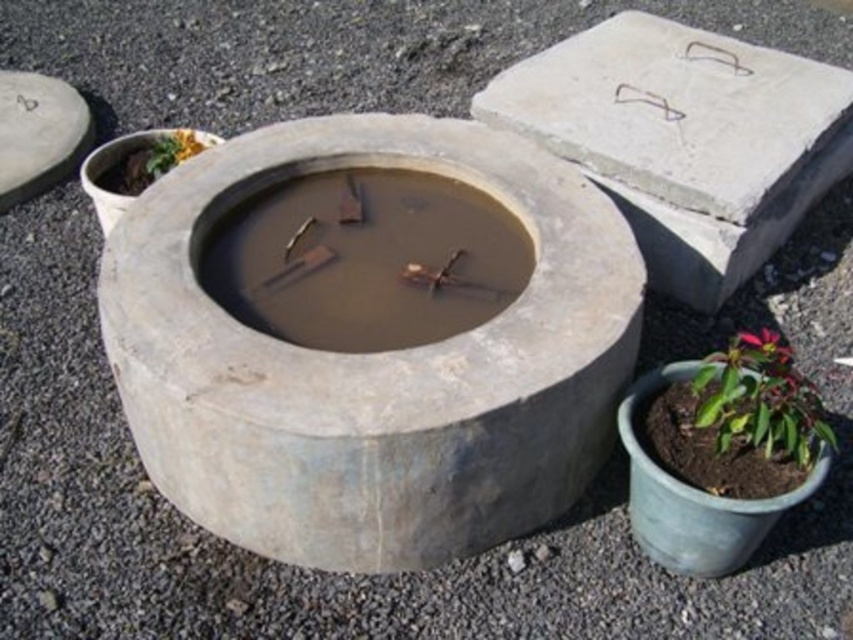
You are standing at the fire pit and want to place a small decorative stone between the two points labeled point (437, 353) and point (773, 333). Which point should you place the stone closer to in order to have it appear larger to someone looking from your position?

To make the stone appear larger, place it closer to point (437, 353) because it is nearer to the viewer compared to point (773, 333).